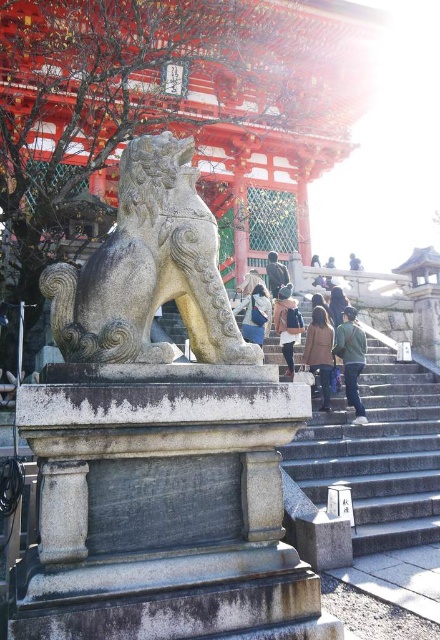
You are standing at the entrance of the temple and see the gray stone stairs at center and the green fabric jacket at center. Which object is closer to the ground?

The gray stone stairs at center is closer to the ground because it is below the green fabric jacket at center.

You are standing in front of the traditional Japanese temple and want to take a photo. You notice two points marked in the scene. Which of these points, point (411, 445) or point (326, 340), is closer to your camera lens?

Point (411, 445) is closer to the camera lens than point (326, 340).